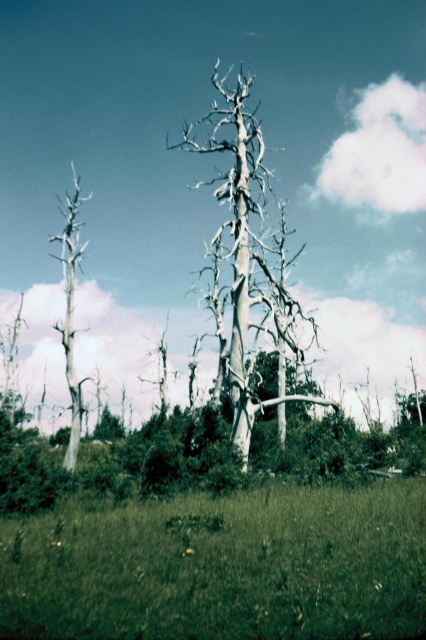
Looking at this image, can you confirm if white textured tree at center is positioned above gray bark tree at left?

Correct, white textured tree at center is located above gray bark tree at left.

Where is `white textured tree at center`? The height and width of the screenshot is (640, 426). white textured tree at center is located at coordinates (241, 243).

Find the location of a particular element. white textured tree at center is located at coordinates (241, 243).

Is green grass at lower center thinner than white textured tree at center?

Correct, green grass at lower center's width is less than white textured tree at center's.

Which is behind, point (100, 570) or point (249, 220)?

Point (249, 220)

The height and width of the screenshot is (640, 426). What are the coordinates of `green grass at lower center` in the screenshot? It's located at (222, 566).

Between point (48, 609) and point (66, 237), which one is positioned in front?

Point (48, 609) is in front.

Consider the image. Is green grass at lower center below gray bark tree at left?

Indeed, green grass at lower center is positioned under gray bark tree at left.

Identify the location of green grass at lower center. (222, 566).